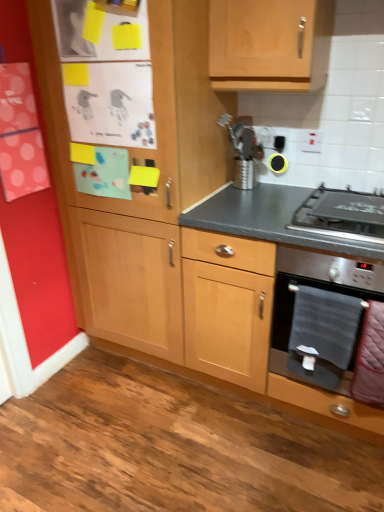
Describe the element at coordinates (155, 118) in the screenshot. I see `wooden cabinet at left, which ranks as the 2th cabinetry in right-to-left order` at that location.

Where is `stainless steel gas stove at lower right`? This screenshot has height=512, width=384. stainless steel gas stove at lower right is located at coordinates (342, 215).

Identify the location of matte wood cabinet at lower right, the second cabinetry when ordered from left to right. (287, 276).

Between matte wood cabinet at lower right, the second cabinetry when ordered from left to right, and wooden cabinet at left, which ranks as the 2th cabinetry in right-to-left order, which one has less height?

matte wood cabinet at lower right, the second cabinetry when ordered from left to right, is shorter.

Is matte wood cabinet at lower right, the second cabinetry when ordered from left to right, oriented towards wooden cabinet at left, which ranks as the 2th cabinetry in right-to-left order?

No, matte wood cabinet at lower right, the second cabinetry when ordered from left to right, is not facing towards wooden cabinet at left, which ranks as the 2th cabinetry in right-to-left order.

From the image's perspective, which one is positioned higher, matte wood cabinet at lower right, which is counted as the 1th cabinetry, starting from the right, or wooden cabinet at left, which ranks as the 2th cabinetry in right-to-left order?

From the image's view, wooden cabinet at left, which ranks as the 2th cabinetry in right-to-left order, is above.

Find the location of a particular element. Image resolution: width=384 pixels, height=512 pixels. cabinetry above the matte wood cabinet at lower right, which is counted as the 1th cabinetry, starting from the right (from a real-world perspective) is located at coordinates (155, 118).

From a real-world perspective, is stainless steel oven at lower right physically located above or below gray fabric towel at lower right, which is counted as the first blanket, starting from the left?

From a real-world perspective, stainless steel oven at lower right is physically above gray fabric towel at lower right, which is counted as the first blanket, starting from the left.

Can you confirm if stainless steel oven at lower right is wider than gray fabric towel at lower right, which is counted as the first blanket, starting from the left?

Yes, stainless steel oven at lower right is wider than gray fabric towel at lower right, which is counted as the first blanket, starting from the left.

In the scene shown: Is stainless steel oven at lower right next to gray fabric towel at lower right, which is counted as the first blanket, starting from the left?

Absolutely, stainless steel oven at lower right is next to and touching gray fabric towel at lower right, which is counted as the first blanket, starting from the left.

Who is bigger, stainless steel oven at lower right or gray fabric towel at lower right, which appears as the second blanket when viewed from the right?

stainless steel oven at lower right is bigger.

From the picture: From the image's perspective, is velvet pink blanket at lower right, which is counted as the first blanket, starting from the right, beneath stainless steel gas stove at lower right?

Yes, from the image's perspective, velvet pink blanket at lower right, which is counted as the first blanket, starting from the right, is beneath stainless steel gas stove at lower right.

Starting from the stainless steel gas stove at lower right, which blanket is the 2nd one in front? Please provide its 2D coordinates.

[(370, 358)]

Can you tell me how much velvet pink blanket at lower right, the 2th blanket positioned from the left, and stainless steel gas stove at lower right differ in facing direction?

velvet pink blanket at lower right, the 2th blanket positioned from the left, and stainless steel gas stove at lower right are facing 0.487 degrees away from each other.

Consider the image. Between velvet pink blanket at lower right, the 2th blanket positioned from the left, and stainless steel gas stove at lower right, which one appears on the right side from the viewer's perspective?

Positioned to the right is velvet pink blanket at lower right, the 2th blanket positioned from the left.

Is black rubber earbud at upper center looking in the opposite direction of wooden cabinet at left, which ranks as the 2th cabinetry in right-to-left order?

That's not correct — black rubber earbud at upper center is not looking away from wooden cabinet at left, which ranks as the 2th cabinetry in right-to-left order.

In the scene shown: Considering the sizes of black rubber earbud at upper center and wooden cabinet at left, which ranks as the 2th cabinetry in right-to-left order, in the image, is black rubber earbud at upper center bigger or smaller than wooden cabinet at left, which ranks as the 2th cabinetry in right-to-left order,?

black rubber earbud at upper center is smaller than wooden cabinet at left, which ranks as the 2th cabinetry in right-to-left order.

Where is `the 2nd cabinetry in front of the black rubber earbud at upper center, starting your count from the anchor`? the 2nd cabinetry in front of the black rubber earbud at upper center, starting your count from the anchor is located at coordinates (155, 118).

In the scene shown: Is stainless steel oven at lower right outside of stainless steel gas stove at lower right?

Yes, stainless steel oven at lower right is outside of stainless steel gas stove at lower right.

Considering the sizes of objects stainless steel oven at lower right and stainless steel gas stove at lower right in the image provided, who is wider, stainless steel oven at lower right or stainless steel gas stove at lower right?

With larger width is stainless steel oven at lower right.

From a real-world perspective, between stainless steel oven at lower right and stainless steel gas stove at lower right, who is vertically higher?

From a 3D spatial view, stainless steel gas stove at lower right is above.

Does stainless steel oven at lower right turn towards stainless steel gas stove at lower right?

No, stainless steel oven at lower right is not aimed at stainless steel gas stove at lower right.

Is stainless steel gas stove at lower right far from wooden cabinet at left, which ranks as the 2th cabinetry in right-to-left order?

stainless steel gas stove at lower right is near wooden cabinet at left, which ranks as the 2th cabinetry in right-to-left order, not far away.

From the image's perspective, is stainless steel gas stove at lower right located above or below wooden cabinet at left, placed as the 1th cabinetry when sorted from left to right?

stainless steel gas stove at lower right is below wooden cabinet at left, placed as the 1th cabinetry when sorted from left to right.

How distant is stainless steel gas stove at lower right from wooden cabinet at left, placed as the 1th cabinetry when sorted from left to right?

A distance of 27.57 inches exists between stainless steel gas stove at lower right and wooden cabinet at left, placed as the 1th cabinetry when sorted from left to right.

Does stainless steel gas stove at lower right have a smaller size compared to wooden cabinet at left, which ranks as the 2th cabinetry in right-to-left order?

Indeed, stainless steel gas stove at lower right has a smaller size compared to wooden cabinet at left, which ranks as the 2th cabinetry in right-to-left order.

From the image's perspective, is black rubber earbud at upper center beneath gray fabric towel at lower right, which is counted as the first blanket, starting from the left?

Actually, black rubber earbud at upper center appears above gray fabric towel at lower right, which is counted as the first blanket, starting from the left, in the image.

Looking at this image, is black rubber earbud at upper center taller or shorter than gray fabric towel at lower right, which is counted as the first blanket, starting from the left?

Clearly, black rubber earbud at upper center is shorter compared to gray fabric towel at lower right, which is counted as the first blanket, starting from the left.

Considering the positions of points (269, 161) and (317, 367), is point (269, 161) farther from camera compared to point (317, 367)?

Yes, it is.

From the black rubber earbud at upper center, count 1st blanket to the right and point to it. Please provide its 2D coordinates.

[(322, 335)]

You are a GUI agent. You are given a task and a screenshot of the screen. Output one action in this format:
    pyautogui.click(x=<x>, y=<y>)
    Task: Click on the cabinetry above the matte wood cabinet at lower right, the second cabinetry when ordered from left to right (from a real-world perspective)
    
    Given the screenshot: What is the action you would take?
    pyautogui.click(x=155, y=118)

Locate an element on the screen. kitchen appliance in front of the gray fabric towel at lower right, which appears as the second blanket when viewed from the right is located at coordinates (317, 288).

Estimate the real-world distances between objects in this image. Which object is closer to stainless steel gas stove at lower right, wooden cabinet at left, placed as the 1th cabinetry when sorted from left to right, or matte wood cabinet at lower right, the second cabinetry when ordered from left to right?

Among the two, matte wood cabinet at lower right, the second cabinetry when ordered from left to right, is located nearer to stainless steel gas stove at lower right.

Based on their spatial positions, is matte wood cabinet at lower right, the second cabinetry when ordered from left to right, or stainless steel gas stove at lower right closer to wooden cabinet at left, placed as the 1th cabinetry when sorted from left to right?

matte wood cabinet at lower right, the second cabinetry when ordered from left to right, is closer to wooden cabinet at left, placed as the 1th cabinetry when sorted from left to right.

Based on their spatial positions, is black rubber earbud at upper center or wooden cabinet at left, placed as the 1th cabinetry when sorted from left to right, closer to matte wood cabinet at lower right, which is counted as the 1th cabinetry, starting from the right?

Among the two, wooden cabinet at left, placed as the 1th cabinetry when sorted from left to right, is located nearer to matte wood cabinet at lower right, which is counted as the 1th cabinetry, starting from the right.

Based on the photo, looking at the image, which one is located closer to black rubber earbud at upper center, matte wood cabinet at lower right, the second cabinetry when ordered from left to right, or wooden cabinet at left, placed as the 1th cabinetry when sorted from left to right?

wooden cabinet at left, placed as the 1th cabinetry when sorted from left to right.

Considering their positions, is velvet pink blanket at lower right, the 2th blanket positioned from the left, positioned further to gray fabric towel at lower right, which is counted as the first blanket, starting from the left, than stainless steel gas stove at lower right?

stainless steel gas stove at lower right is positioned further to the anchor gray fabric towel at lower right, which is counted as the first blanket, starting from the left.

Considering their positions, is matte wood cabinet at lower right, which is counted as the 1th cabinetry, starting from the right, positioned closer to velvet pink blanket at lower right, the 2th blanket positioned from the left, than wooden cabinet at left, which ranks as the 2th cabinetry in right-to-left order?

The object closer to velvet pink blanket at lower right, the 2th blanket positioned from the left, is matte wood cabinet at lower right, which is counted as the 1th cabinetry, starting from the right.

Looking at the image, which one is located closer to matte wood cabinet at lower right, which is counted as the 1th cabinetry, starting from the right, black rubber earbud at upper center or stainless steel gas stove at lower right?

Among the two, stainless steel gas stove at lower right is located nearer to matte wood cabinet at lower right, which is counted as the 1th cabinetry, starting from the right.

Looking at the image, which one is located further to velvet pink blanket at lower right, the 2th blanket positioned from the left, wooden cabinet at left, placed as the 1th cabinetry when sorted from left to right, or matte wood cabinet at lower right, which is counted as the 1th cabinetry, starting from the right?

Based on the image, wooden cabinet at left, placed as the 1th cabinetry when sorted from left to right, appears to be further to velvet pink blanket at lower right, the 2th blanket positioned from the left.

Identify the location of kitchen appliance between black rubber earbud at upper center and velvet pink blanket at lower right, which is counted as the first blanket, starting from the right, from top to bottom. This screenshot has width=384, height=512. (317, 288).

Where is `kitchen appliance between stainless steel gas stove at lower right and matte wood cabinet at lower right, the second cabinetry when ordered from left to right, vertically`? The width and height of the screenshot is (384, 512). kitchen appliance between stainless steel gas stove at lower right and matte wood cabinet at lower right, the second cabinetry when ordered from left to right, vertically is located at coordinates (317, 288).

This screenshot has height=512, width=384. In order to click on gas stove between black rubber earbud at upper center and velvet pink blanket at lower right, the 2th blanket positioned from the left, in the vertical direction in this screenshot , I will do click(x=342, y=215).

Identify the location of blanket situated between wooden cabinet at left, placed as the 1th cabinetry when sorted from left to right, and stainless steel gas stove at lower right from left to right. (322, 335).